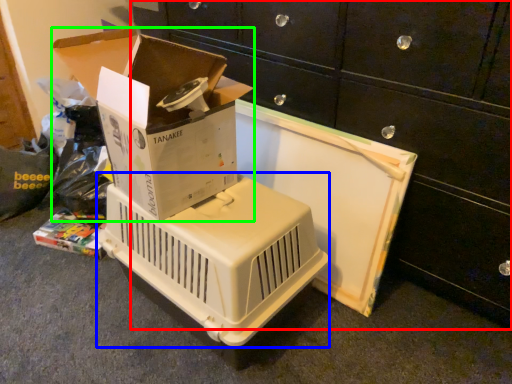
Question: Estimate the real-world distances between objects in this image. Which object is closer to furniture (highlighted by a red box), appliance (highlighted by a blue box) or box (highlighted by a green box)?

Choices:
 (A) appliance
 (B) box

Answer: (B)